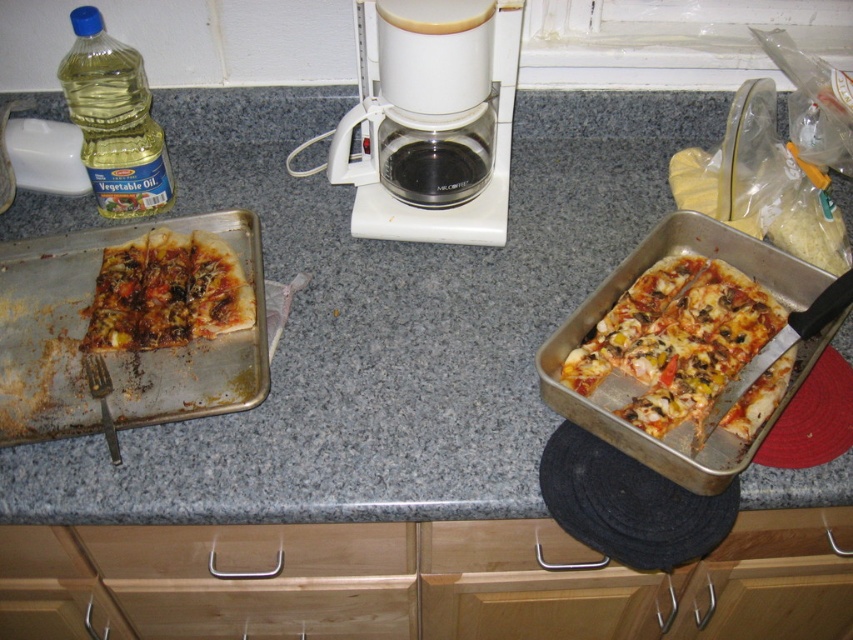
You are a chef preparing to place a new dish on the granite gray counter top at center or the cheesy pizza at right. Which surface has enough space for the dish?

The granite gray counter top at center is bigger than the cheesy pizza at right, so the dish can fit on the granite gray counter top at center.

You are a delivery person who just arrived at the kitchen. You need to place a 75 cm long package on the countertop without moving any items. Is there enough space between the cheesy pizza at right and the edge of the countertop to fit the package?

The distance between the cheesy pizza at right and the viewer is 74.09 centimeters. Since the package is 75 cm long, there isn not enough space to place it without moving items.

You are a barista preparing a coffee order. You need to quickly grab the white plastic coffee maker at center and the translucent yellow vegetable oil at left. Which one will you reach first?

You will reach the white plastic coffee maker at center first because it is closer to you than the translucent yellow vegetable oil at left.